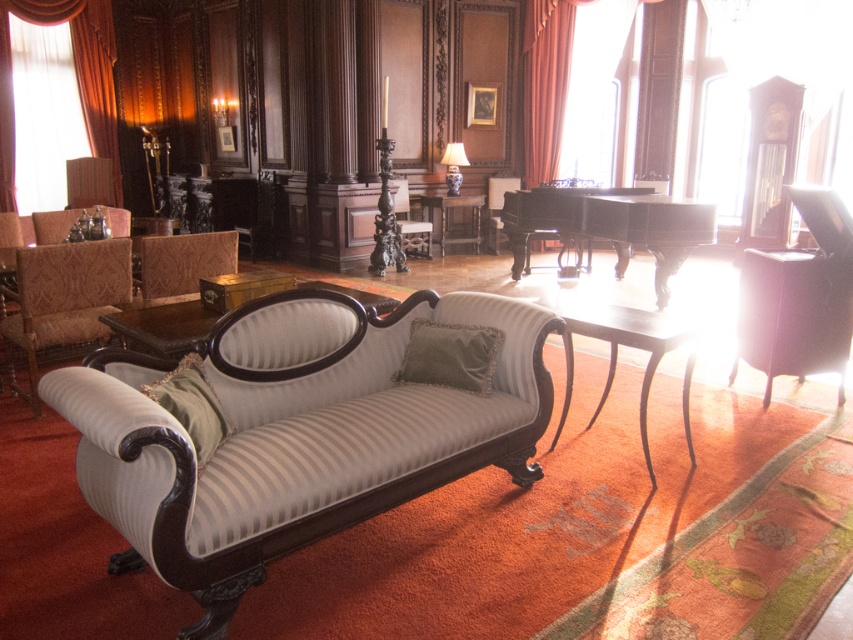
You are a professional interior designer planning to move a large sofa that is 2.5 meters wide into this room. The sofa needs to be placed between the black polished wood piano at center and the silky orange curtain at left. Is there enough space to fit the sofa between them without overlapping?

The distance between the black polished wood piano at center and the silky orange curtain at left is 6.69 meters. Since the sofa is 2.5 meters wide, there is sufficient space as 6.69 meters is greater than 2.5 meters.

You are a guest entering the living room and want to sit on the striped fabric couch at center. Can you easily see the velvet drapery at upper right from there?

The striped fabric couch at center has a lesser height compared to velvet drapery at upper right, so yes, you can easily see the velvet drapery at upper right from the striped fabric couch at center because it is taller.